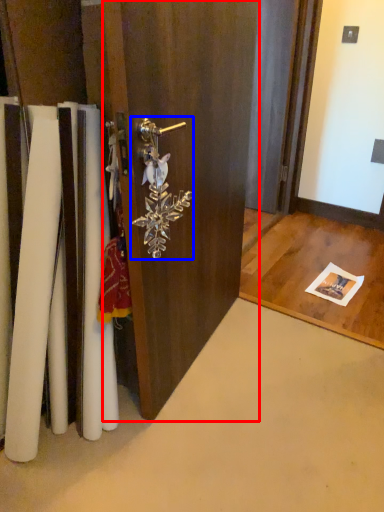
Question: Which object appears closest to the camera in this image, door (highlighted by a red box) or door handle (highlighted by a blue box)?

Choices:
 (A) door
 (B) door handle

Answer: (A)